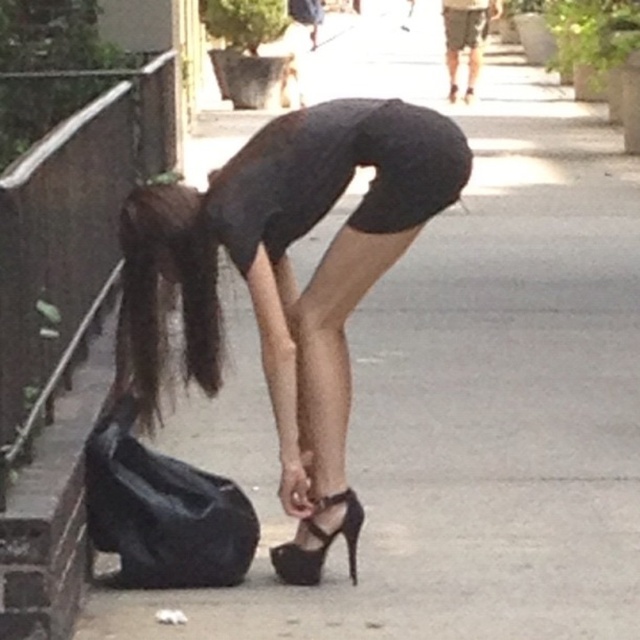
Question: Can you confirm if black leather high heels at center is wider than black leather high-heeled sandal at lower center?

Choices:
 (A) no
 (B) yes

Answer: (B)

Question: Does black leather high heels at center have a lesser width compared to black patent leather high-heeled shoe at center?

Choices:
 (A) yes
 (B) no

Answer: (B)

Question: Among these points, which one is farthest from the camera?

Choices:
 (A) (276, 566)
 (B) (401, 211)

Answer: (A)

Question: Is black leather high heels at center positioned in front of black leather high-heeled sandal at lower center?

Choices:
 (A) no
 (B) yes

Answer: (B)

Question: Which point appears farthest from the camera in this image?

Choices:
 (A) (451, 92)
 (B) (355, 524)
 (C) (132, 301)

Answer: (A)

Question: Among these objects, which one is farthest from the camera?

Choices:
 (A) black patent leather high-heeled shoe at center
 (B) black leather high-heeled sandal at lower center
 (C) black leather high heels at center

Answer: (A)